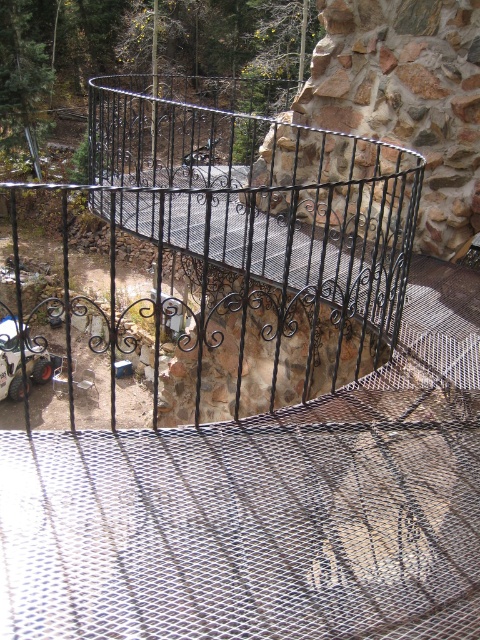
Question: Which object is closer to the camera taking this photo?

Choices:
 (A) metallic car at lower left
 (B) black wrought iron cage at center

Answer: (B)

Question: Is black wrought iron cage at center positioned in front of metallic car at lower left?

Choices:
 (A) no
 (B) yes

Answer: (B)

Question: Does black wrought iron cage at center come in front of metallic car at lower left?

Choices:
 (A) yes
 (B) no

Answer: (A)

Question: Among these objects, which one is nearest to the camera?

Choices:
 (A) metallic car at lower left
 (B) black wrought iron cage at center

Answer: (B)

Question: Does black wrought iron cage at center appear over metallic car at lower left?

Choices:
 (A) no
 (B) yes

Answer: (B)